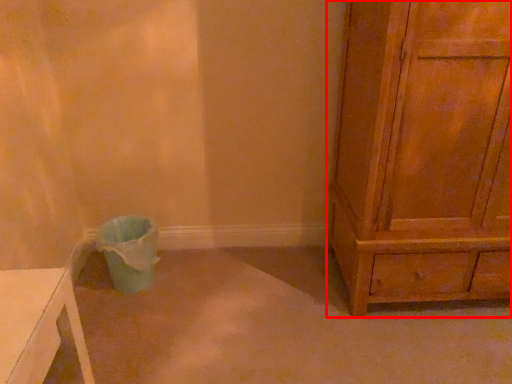
Question: From the image's perspective, where is chest of drawers (annotated by the red box) located relative to potty?

Choices:
 (A) above
 (B) below

Answer: (A)